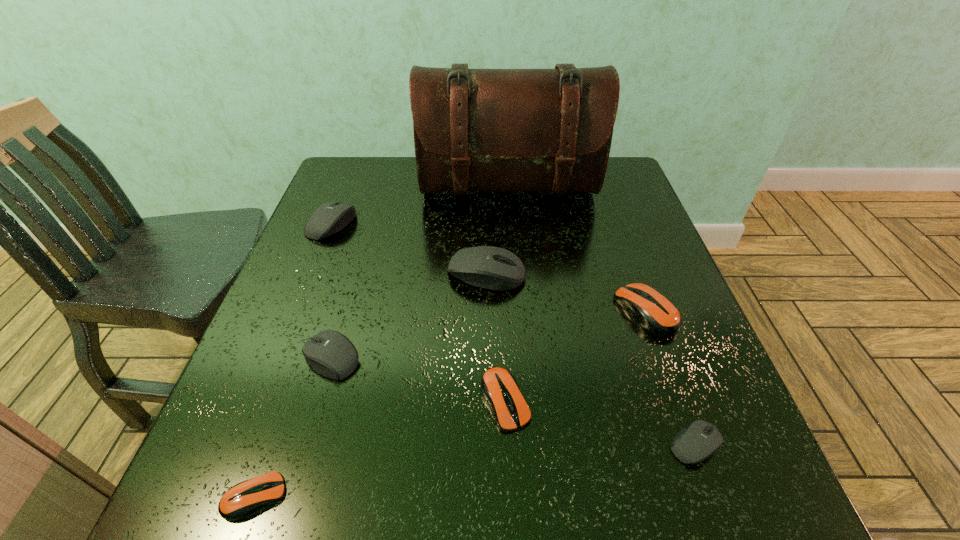
Find the location of a particular element. Image resolution: width=960 pixels, height=540 pixels. vacant space at the right edge is located at coordinates (614, 266).

Locate an element on the screen. The height and width of the screenshot is (540, 960). vacant region at the far left corner of the desktop is located at coordinates (370, 160).

Find the location of a particular element. The image size is (960, 540). free space at the near left corner of the desktop is located at coordinates (241, 522).

This screenshot has width=960, height=540. In order to click on vacant region at the far right corner in this screenshot , I will do `click(615, 172)`.

Locate an element on the screen. The width and height of the screenshot is (960, 540). vacant area between the farthest computer mouse and the second smallest black computer equipment is located at coordinates (331, 291).

You are a GUI agent. You are given a task and a screenshot of the screen. Output one action in this format:
    pyautogui.click(x=<x>, y=<y>)
    Task: Click on the empty space between the farthest orange computer mouse and the nearest orange computer mouse
    The width and height of the screenshot is (960, 540).
    Given the screenshot: What is the action you would take?
    pyautogui.click(x=450, y=404)

This screenshot has width=960, height=540. Find the location of `vacant space in between the third biggest black computer equipment and the shortest computer mouse`. vacant space in between the third biggest black computer equipment and the shortest computer mouse is located at coordinates (293, 427).

The height and width of the screenshot is (540, 960). Find the location of `free space between the rightmost orange computer mouse and the second orange computer mouse from left to right`. free space between the rightmost orange computer mouse and the second orange computer mouse from left to right is located at coordinates (575, 356).

At what (x,y) coordinates should I click in order to perform the action: click on blank region between the second smallest black computer equipment and the biggest black computer equipment. Please return your answer as a coordinate pair (x, y). This screenshot has height=540, width=960. Looking at the image, I should click on (409, 315).

In order to click on empty space between the second orange computer mouse from right to left and the nearest black computer equipment in this screenshot , I will do `click(600, 423)`.